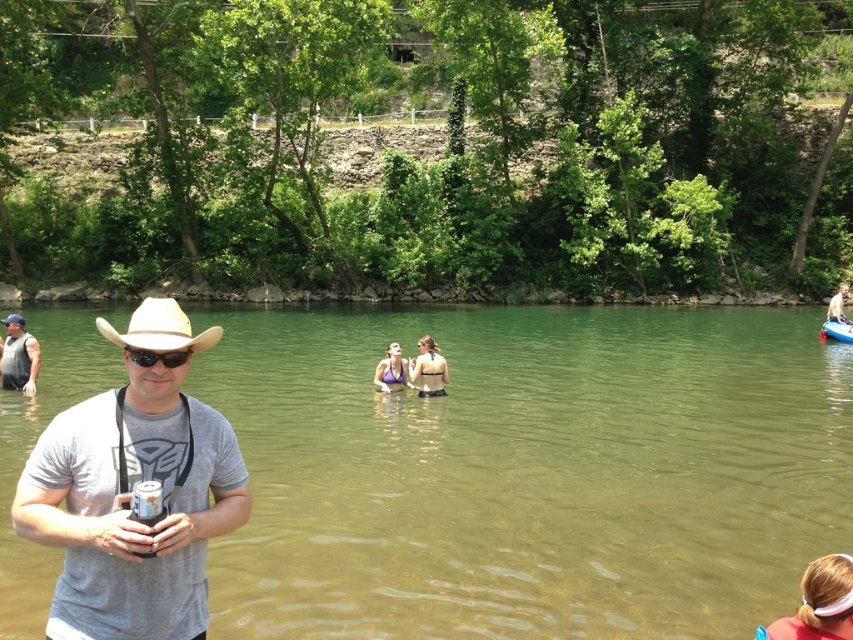
Question: Estimate the real-world distances between objects in this image. Which object is closer to the white fabric headband at lower right?

Choices:
 (A) matte gray shirt at center
 (B) clear water at center
 (C) beige straw cowboy hat at left
 (D) gray cotton t-shirt at left

Answer: (D)

Question: Which point is closer to the camera?

Choices:
 (A) clear water at center
 (B) matte gray shirt at center
 (C) gray cotton t-shirt at left
 (D) matte black bikini at center

Answer: (C)

Question: Is the position of matte gray shirt at center more distant than that of black matte sunglasses at center?

Choices:
 (A) yes
 (B) no

Answer: (A)

Question: Where is white fabric headband at lower right located in relation to black matte sunglasses at center in the image?

Choices:
 (A) above
 (B) below

Answer: (B)

Question: Is beige straw cowboy hat at left further to the viewer compared to black matte sunglasses at center?

Choices:
 (A) yes
 (B) no

Answer: (B)

Question: Which of these objects is positioned farthest from the matte gray shirt at center?

Choices:
 (A) purple fabric bikini at center
 (B) white plastic canoe at upper right
 (C) gray cotton t-shirt at left
 (D) white fabric headband at lower right

Answer: (B)